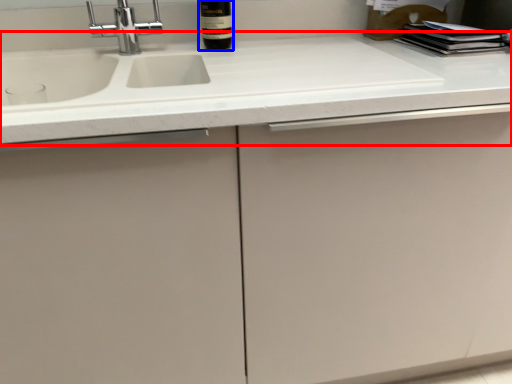
Question: Which object is closer to the camera taking this photo, countertop (highlighted by a red box) or bottle (highlighted by a blue box)?

Choices:
 (A) countertop
 (B) bottle

Answer: (A)